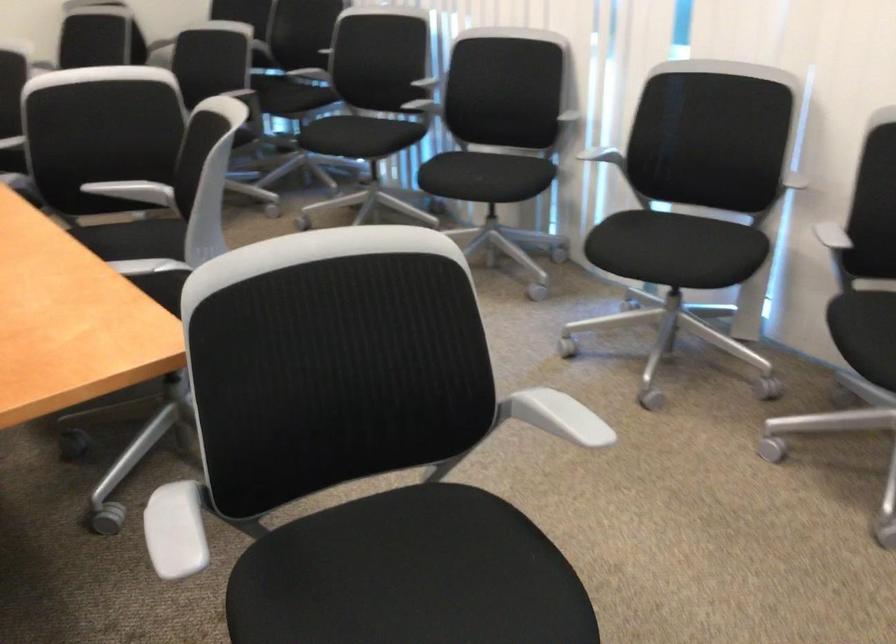
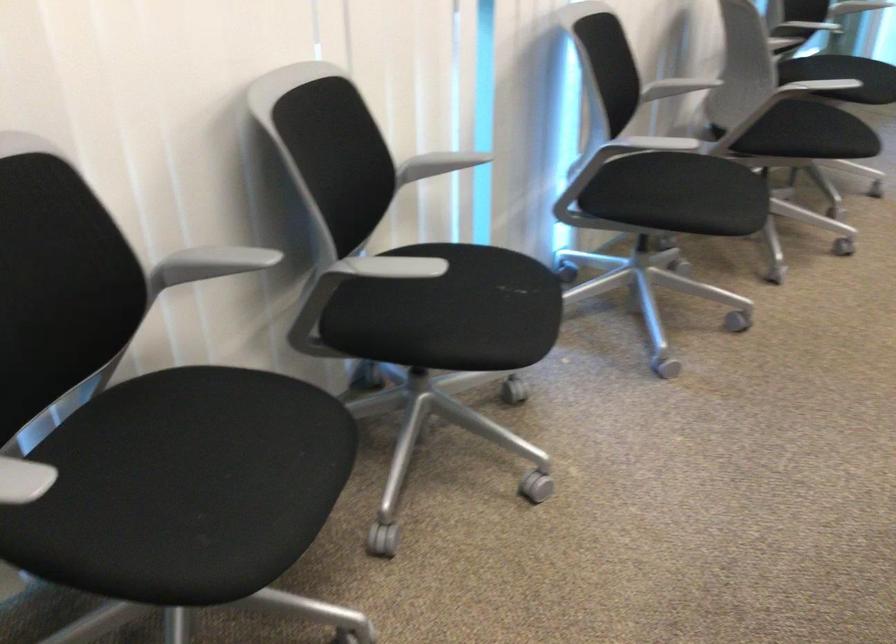
In the second image, find the point that corresponds to point (565, 118) in the first image.

(438, 164)